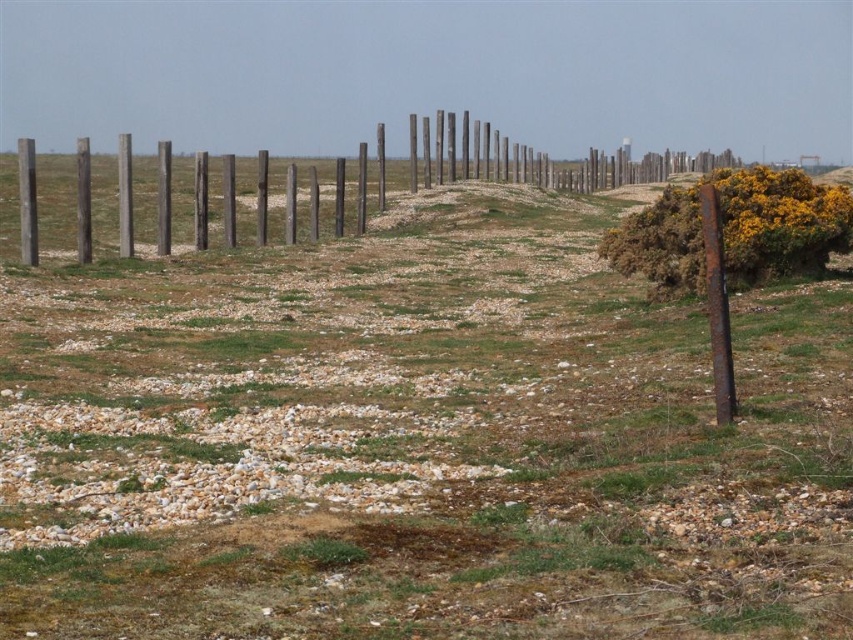
Between weathered wood fence at center and rusty metal post at right, which one appears on the left side from the viewer's perspective?

From the viewer's perspective, weathered wood fence at center appears more on the left side.

Is weathered wood fence at center thinner than rusty metal post at right?

No.

Identify the location of weathered wood fence at center. (x=538, y=161).